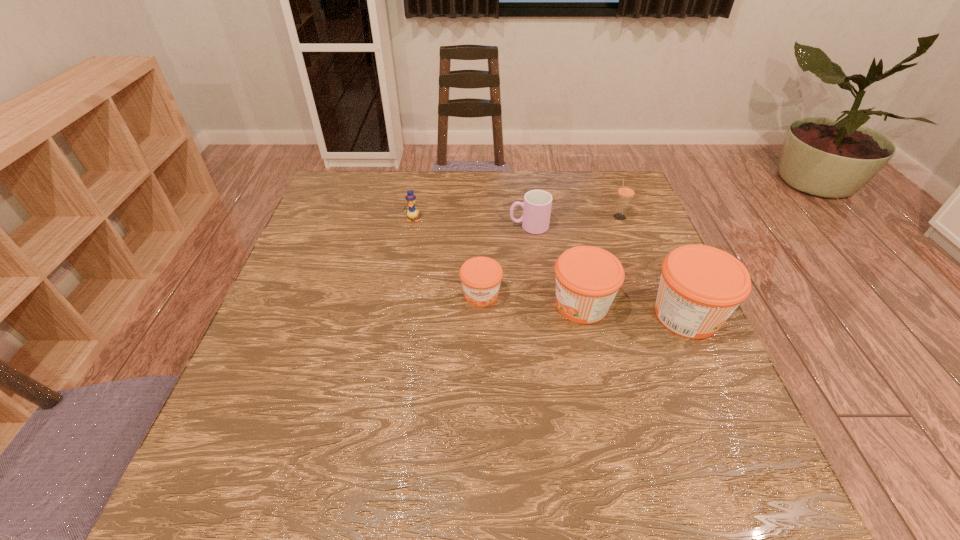
At what (x,y) coordinates should I click in order to perform the action: click on free space at the far edge. Please return your answer as a coordinate pair (x, y). The width and height of the screenshot is (960, 540). Looking at the image, I should click on (472, 184).

Where is `free space at the near edge of the desktop`? The width and height of the screenshot is (960, 540). free space at the near edge of the desktop is located at coordinates (605, 412).

The width and height of the screenshot is (960, 540). In order to click on free space at the left edge of the desktop in this screenshot , I will do `click(325, 332)`.

Find the location of a particular element. The height and width of the screenshot is (540, 960). vacant area at the right edge of the desktop is located at coordinates (694, 359).

This screenshot has width=960, height=540. Find the location of `free space at the far left corner of the desktop`. free space at the far left corner of the desktop is located at coordinates (339, 213).

This screenshot has width=960, height=540. Identify the location of vacant region at the near left corner. (236, 397).

Locate an element on the screen. The image size is (960, 540). free region at the far right corner of the desktop is located at coordinates (612, 172).

Where is `free space between the duckling and the cup`? This screenshot has height=540, width=960. free space between the duckling and the cup is located at coordinates (470, 223).

Find the location of a particular element. unoccupied area between the duckling and the rightmost jam is located at coordinates (549, 267).

Where is `blank region between the second jam from left to right and the shortest jam`? blank region between the second jam from left to right and the shortest jam is located at coordinates (531, 300).